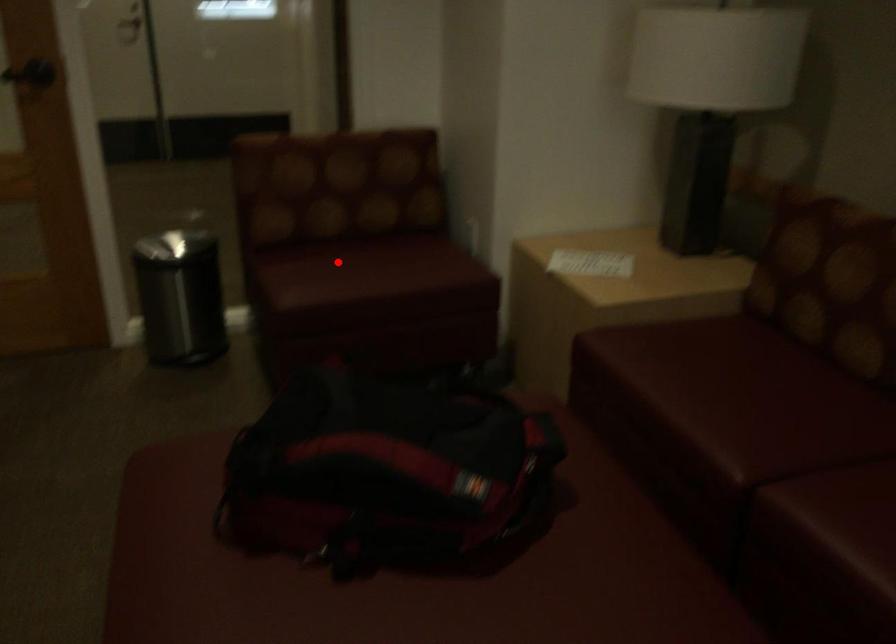
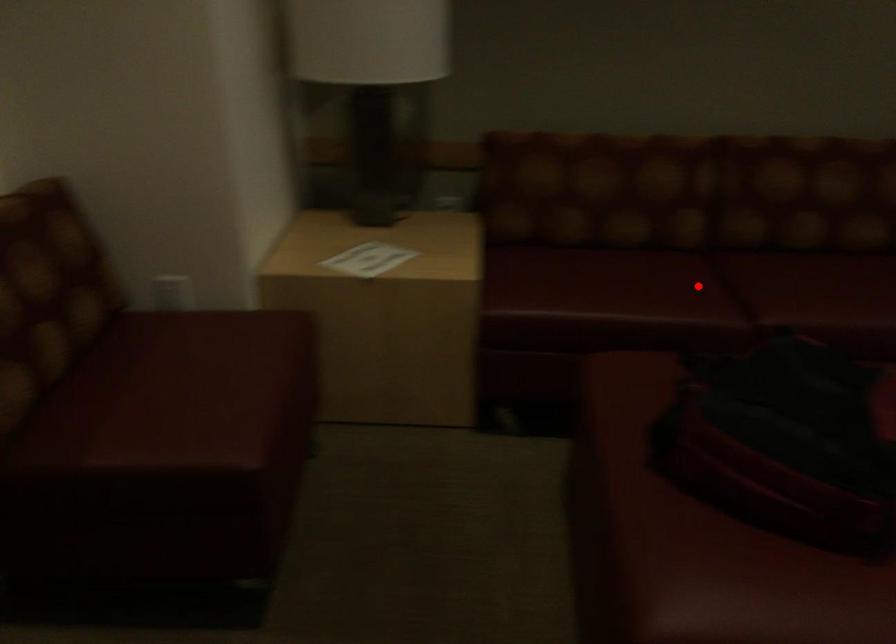
I am providing you with two images of the same scene from different viewpoints. A red point is marked on the first image and another point is marked on the second image. Is the marked point in image1 the same physical position as the marked point in image2?

No